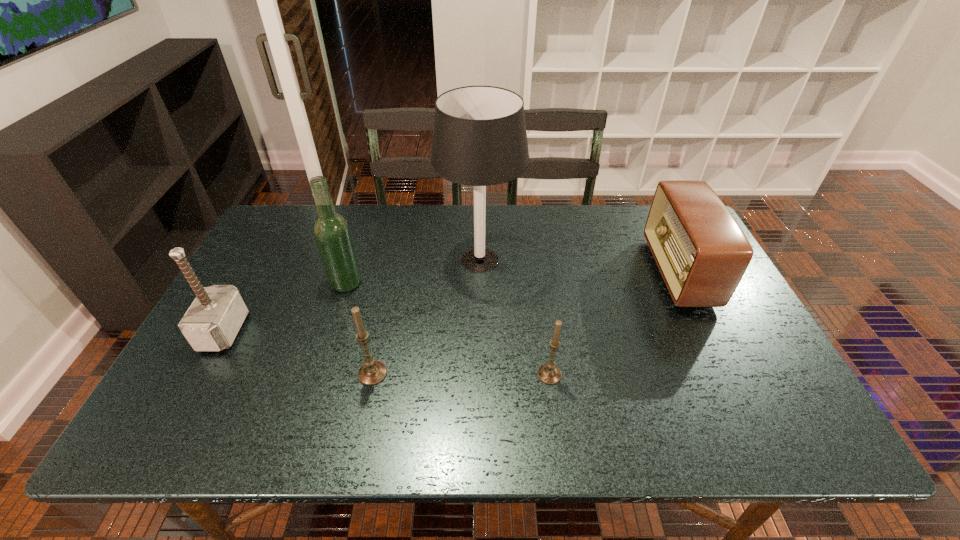
At what (x,y) coordinates should I click in order to perform the action: click on the leftmost object. Please return your answer as a coordinate pair (x, y). The height and width of the screenshot is (540, 960). Looking at the image, I should click on (211, 323).

At what (x,y) coordinates should I click in order to perform the action: click on vacant space located 0.220m on the right of the taller candle. Please return your answer as a coordinate pair (x, y). This screenshot has width=960, height=540. Looking at the image, I should click on (481, 374).

Find the location of `free space located on the left of the shorter candle`. free space located on the left of the shorter candle is located at coordinates (516, 375).

Where is `free space located 0.390m on the right of the second tallest object`? free space located 0.390m on the right of the second tallest object is located at coordinates (498, 283).

Find the location of a particular element. free space located on the front-facing side of the radio receiver is located at coordinates (632, 272).

Locate an element on the screen. blank area located on the front-facing side of the radio receiver is located at coordinates (564, 272).

The width and height of the screenshot is (960, 540). What are the coordinates of `free point located on the front-facing side of the radio receiver` in the screenshot? It's located at (550, 272).

Image resolution: width=960 pixels, height=540 pixels. In order to click on free space located 0.230m on the front of the tallest object in this screenshot , I will do click(480, 355).

Identify the location of vacant space located 0.360m for striking with the head of the leftmost object. This screenshot has height=540, width=960. (383, 331).

The image size is (960, 540). I want to click on radio receiver that is at the far edge, so click(x=701, y=252).